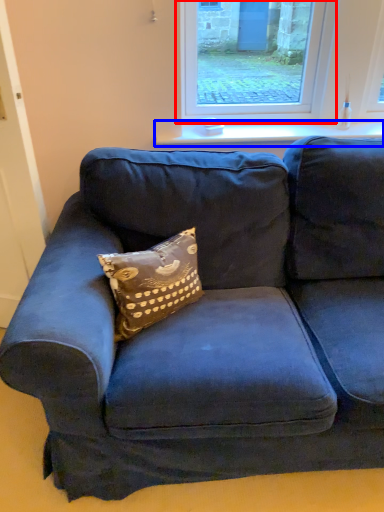
Question: Among these objects, which one is farthest to the camera, window (highlighted by a red box) or window sill (highlighted by a blue box)?

Choices:
 (A) window
 (B) window sill

Answer: (B)